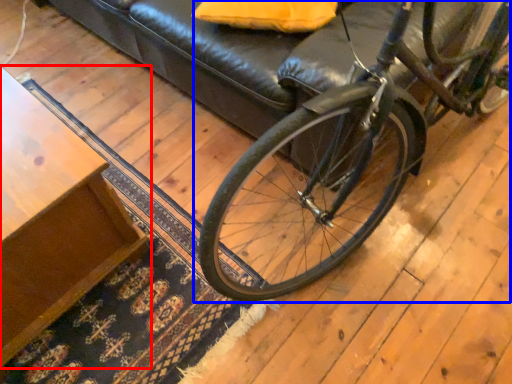
Question: Which of the following is the farthest to the observer, table (highlighted by a red box) or bicycle (highlighted by a blue box)?

Choices:
 (A) table
 (B) bicycle

Answer: (A)